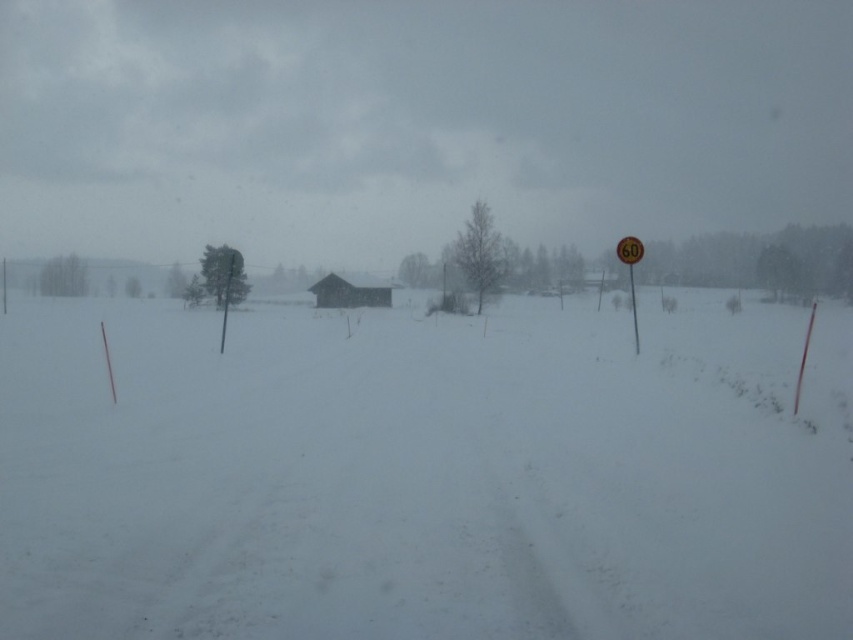
You are driving a car and see the yellow reflective plastic speed limit sign at right and the metallic signpost at right by the snowy road. Which one is taller?

The yellow reflective plastic speed limit sign at right is taller than the metallic signpost at right.

You are driving a car and see the yellow reflective plastic speed limit sign at right and the metallic signpost at right by the snowy road. Which one is larger in size?

The yellow reflective plastic speed limit sign at right is bigger than the metallic signpost at right.

You are standing in the snowy landscape and want to walk from point [636,246] to point [637,340]. Since both points are at the same height level, which direction should you face to move towards the farther point?

Since point [636,246] is closer to the viewer than point [637,340], you should face away from the shed or barn to move towards the farther point [637,340].